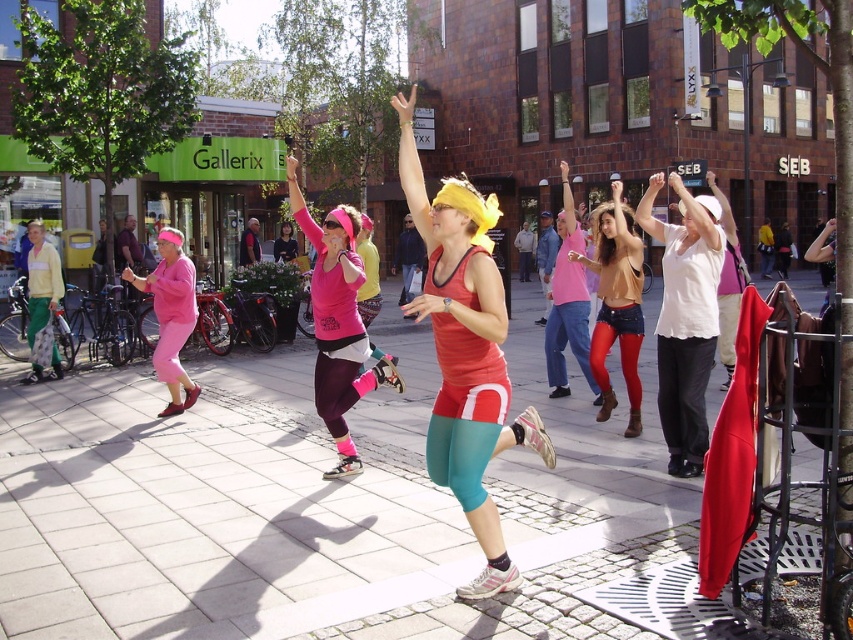
Is matte red tank top at center wider than matte brown leather boots at center?

In fact, matte red tank top at center might be narrower than matte brown leather boots at center.

Consider the image. Can you confirm if matte red tank top at center is thinner than matte brown leather boots at center?

Yes, matte red tank top at center is thinner than matte brown leather boots at center.

Identify the location of matte red tank top at center. Image resolution: width=853 pixels, height=640 pixels. (465, 353).

Looking at this image, can you confirm if matte red tank top at center is smaller than pink matte leggings at center?

Incorrect, matte red tank top at center is not smaller in size than pink matte leggings at center.

Is point (453, 221) closer to viewer compared to point (338, 454)?

Yes.

Locate an element on the screen. matte red tank top at center is located at coordinates (465, 353).

Between pink matte leggings at center and matte brown leather boots at center, which one has more height?

matte brown leather boots at center

You are a GUI agent. You are given a task and a screenshot of the screen. Output one action in this format:
    pyautogui.click(x=<x>, y=<y>)
    Task: Click on the pink matte leggings at center
    This screenshot has height=640, width=853.
    Given the screenshot: What is the action you would take?
    pyautogui.click(x=338, y=323)